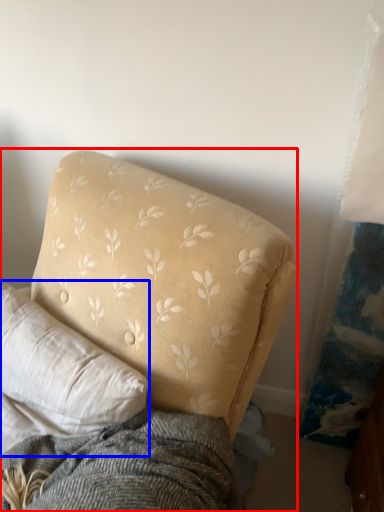
Question: Among these objects, which one is farthest to the camera, studio couch (highlighted by a red box) or pillow (highlighted by a blue box)?

Choices:
 (A) studio couch
 (B) pillow

Answer: (B)